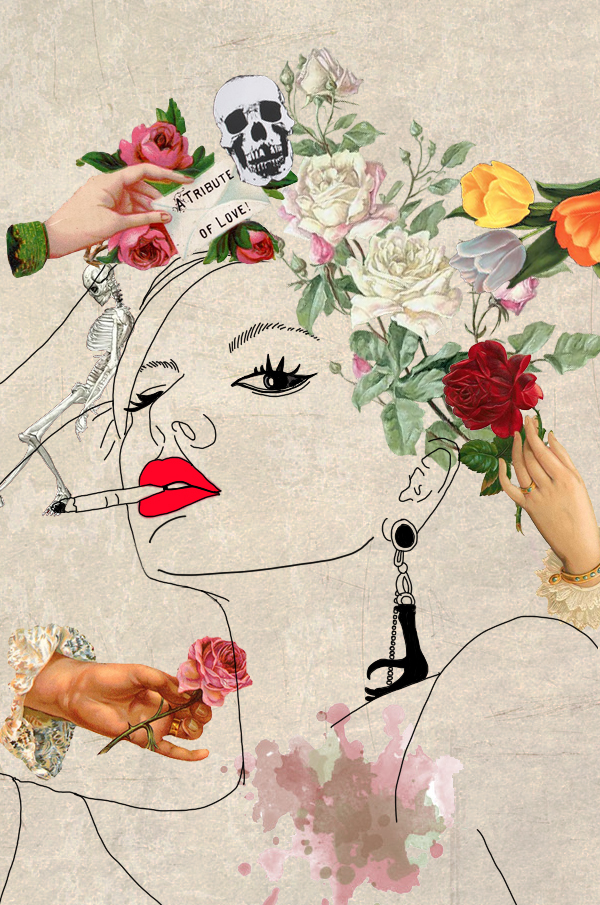
Locate an element on the screen. The image size is (600, 905). art is located at coordinates (286, 475).